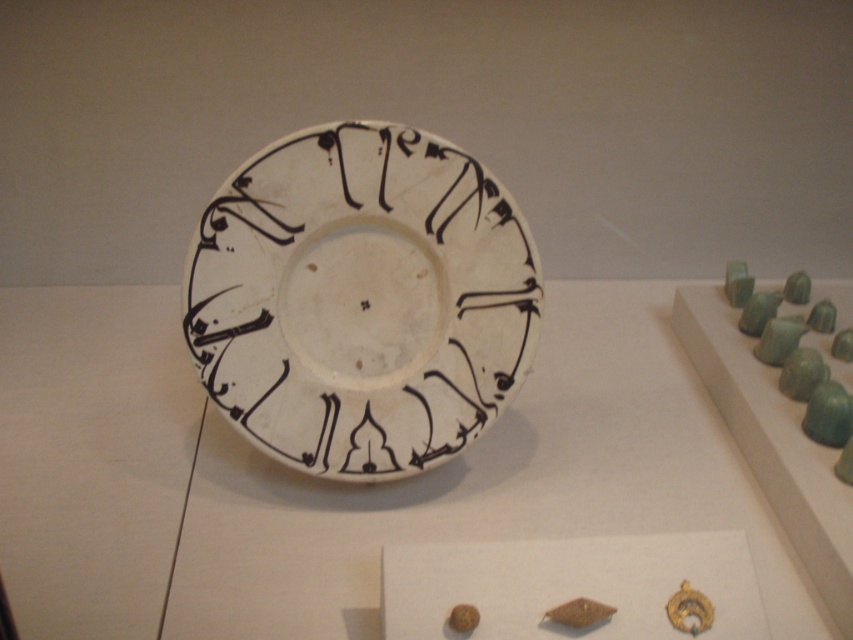
From the picture: You are standing in front of the display case and want to take a photo of the point at coordinates (315,468). If your camera has a maximum focus distance of 1.5 meters, will it be able to focus on the point?

The point at coordinates (315,468) is 1.35 meters away from the viewer, which is within the camera maximum focus distance of 1.5 meters. Therefore, the camera can focus on the point.

Consider the image. You are a museum curator planning to move the white glossy plate at center closer to the green jade beads at right. The display case has a 30 inch clearance between the two. Can you move the plate to the beads without removing it from the case?

The white glossy plate at center is currently 26.40 inches away from the green jade beads at right. Since the display case has a 30 inch clearance, moving the plate closer would require reducing the distance by 3.6 inches. This is feasible within the available space, so yes, the plate can be moved closer to the beads without needing to remove it from the case.